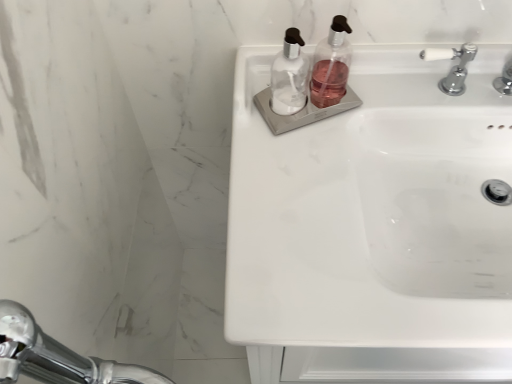
Where is `free space in front of transparent plastic soap dispenser at upper center, which ranks as the second soap dispenser in left-to-right order`? This screenshot has height=384, width=512. free space in front of transparent plastic soap dispenser at upper center, which ranks as the second soap dispenser in left-to-right order is located at coordinates (304, 170).